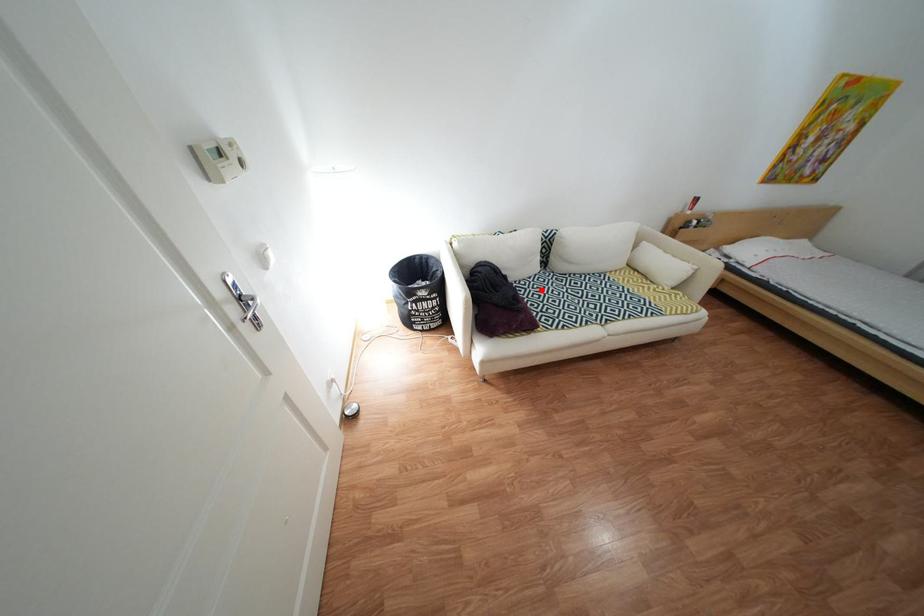
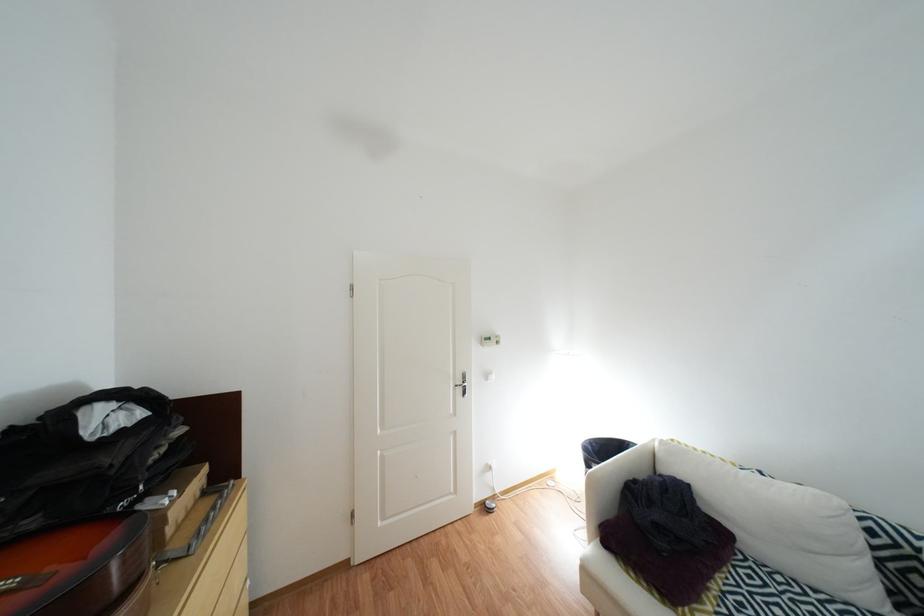
Where in the second image is the point corresponding to the highlighted location from the first image?

(782, 586)